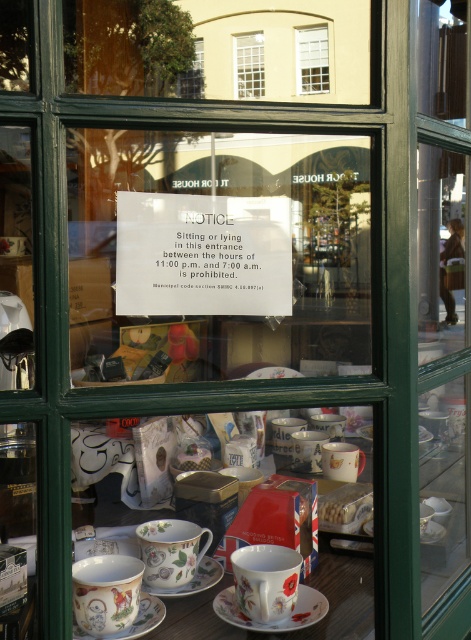
Question: Is white wooden window at upper center positioned in front of porcelain saucer at lower left?

Choices:
 (A) yes
 (B) no

Answer: (B)

Question: Which object is closer to the camera taking this photo?

Choices:
 (A) white glass window at upper center
 (B) porcelain floral saucer at center
 (C) porcelain floral teacup at lower left
 (D) porcelain floral teacup at center

Answer: (C)

Question: Estimate the real-world distances between objects in this image. Which object is farther from the porcelain floral teacup at center?

Choices:
 (A) matte floral teacup at center
 (B) white wooden window at upper center
 (C) porcelain floral saucer at center

Answer: (B)

Question: Is white glass window at upper center closer to camera compared to porcelain saucer at lower left?

Choices:
 (A) no
 (B) yes

Answer: (A)

Question: Which point is closer to the camera?

Choices:
 (A) (143, 624)
 (B) (342, 467)
 (C) (113, 632)
 (D) (240, 547)

Answer: (C)

Question: Can you confirm if white glass window at upper center is positioned to the left of porcelain floral saucer at center?

Choices:
 (A) no
 (B) yes

Answer: (A)